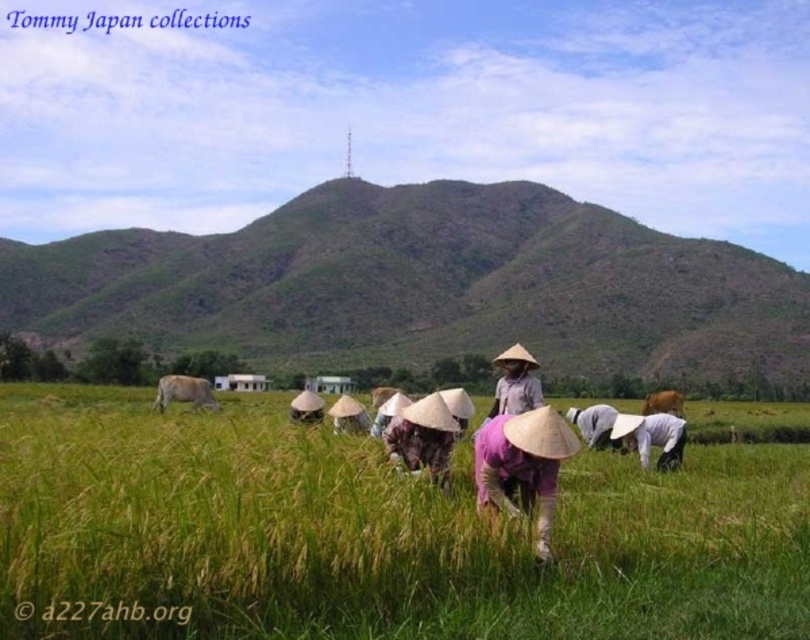
Question: Estimate the real-world distances between objects in this image. Which object is farther from the brown fur at lower center?

Choices:
 (A) purple fabric hat at center
 (B) green grassy rice field at center
 (C) brown furry cow at left
 (D) light purple fabric at center

Answer: (C)

Question: Is brown furry cow at left positioned before brown fur at lower center?

Choices:
 (A) no
 (B) yes

Answer: (B)

Question: Which point is farther to the camera?

Choices:
 (A) (672, 444)
 (B) (534, 428)

Answer: (A)

Question: Is purple fabric hat at center bigger than light purple fabric at center?

Choices:
 (A) no
 (B) yes

Answer: (A)

Question: Does brown furry cow at left come behind brown fur at lower center?

Choices:
 (A) no
 (B) yes

Answer: (A)

Question: Which is farther from the brown furry cow at left?

Choices:
 (A) light purple fabric at center
 (B) purple fabric hat at center
 (C) green grassy rice field at center

Answer: (B)